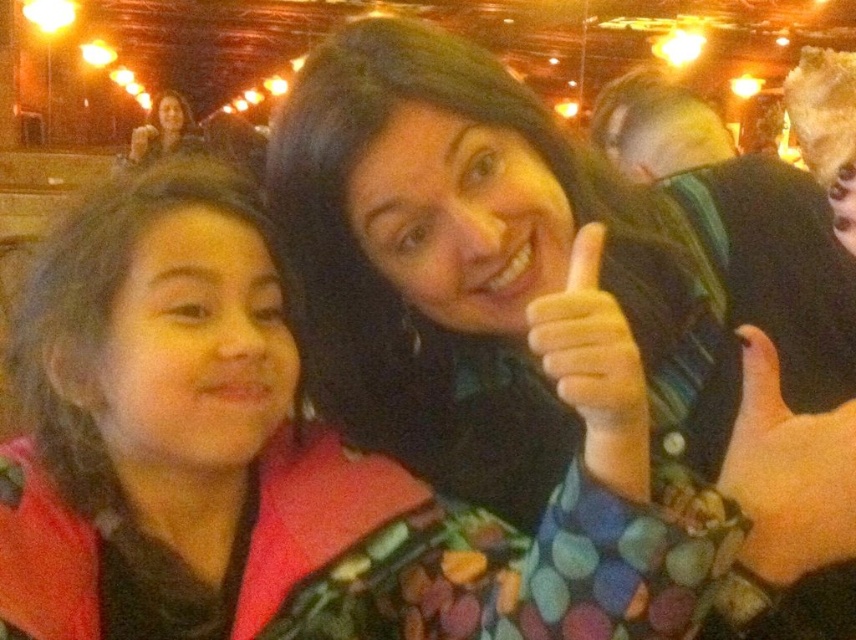
You are standing at the point marked as point (622, 83) in the image. If you want to walk towards the nearest exit, which is located 10 feet away from your current position, can you reach it without moving more than 10 feet?

The distance between point (622, 83) and the viewer is 9.11 feet, so yes, you can reach the nearest exit without moving more than 10 feet since 9.11 feet is less than 10 feet.

You are a photographer standing 24 inches away from the matte black hand at upper center. Can you safely take a photo without getting too close?

The matte black hand at upper center is 23.80 inches away from the viewer. Since you are standing 24 inches away, you are slightly farther than the hand, so you can safely take the photo without getting too close.